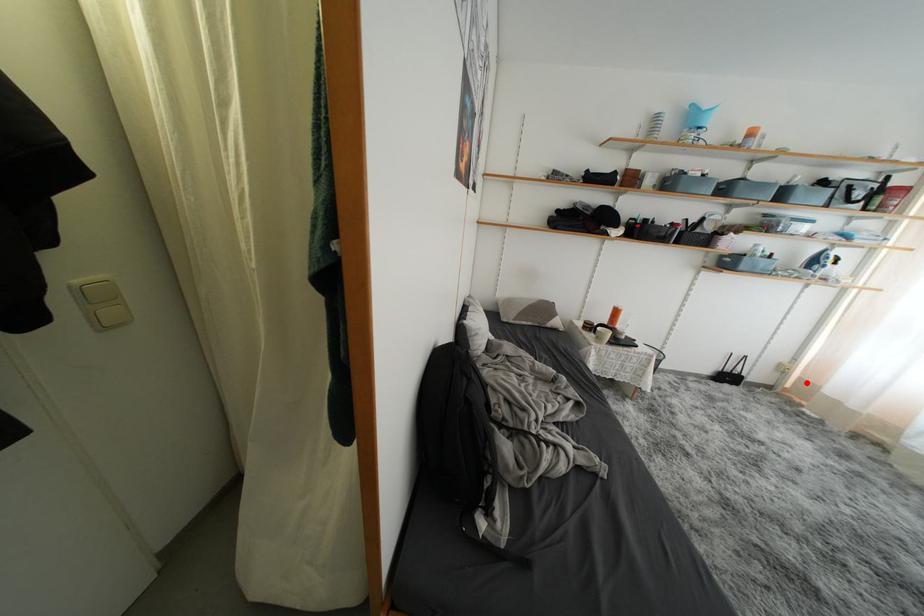
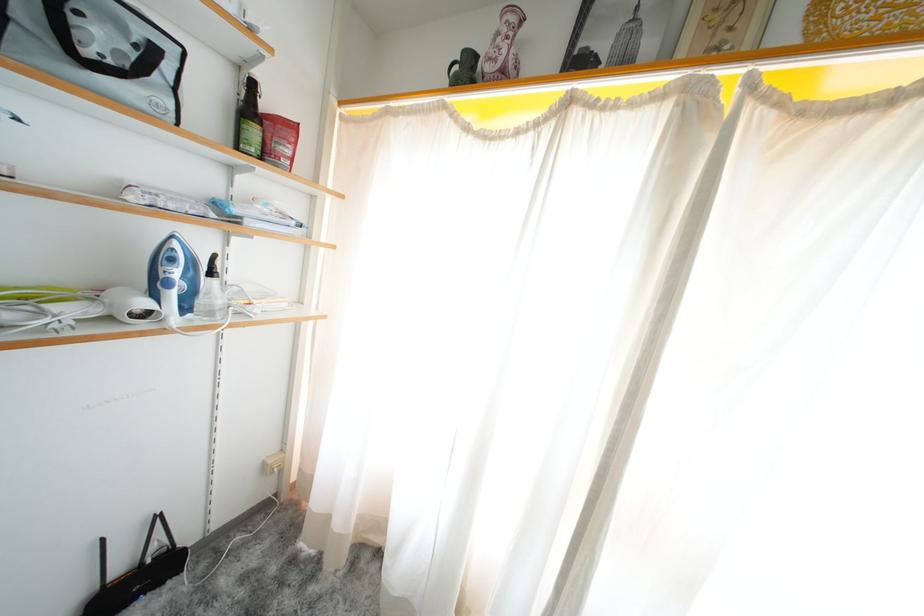
Where in the second image is the point corresponding to the highlighted location from the first image?

(306, 475)